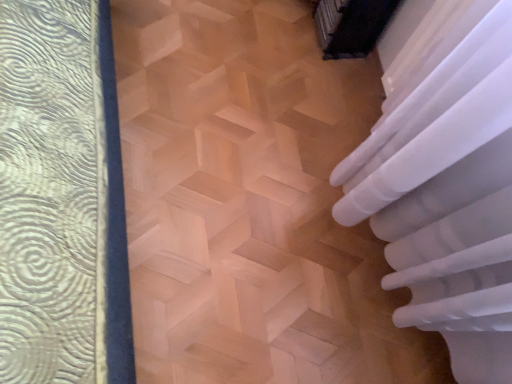
This screenshot has height=384, width=512. What do you see at coordinates (251, 202) in the screenshot? I see `natural wood stairwell at center` at bounding box center [251, 202].

At what (x,y) coordinates should I click in order to perform the action: click on natural wood stairwell at center. Please return your answer as a coordinate pair (x, y). Image resolution: width=512 pixels, height=384 pixels. Looking at the image, I should click on (251, 202).

Find the location of `natural wood stairwell at center`. natural wood stairwell at center is located at coordinates (251, 202).